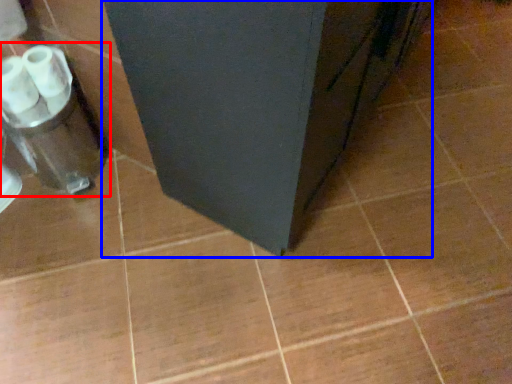
Question: Which object appears farthest to the camera in this image, blender (highlighted by a red box) or furniture (highlighted by a blue box)?

Choices:
 (A) blender
 (B) furniture

Answer: (A)